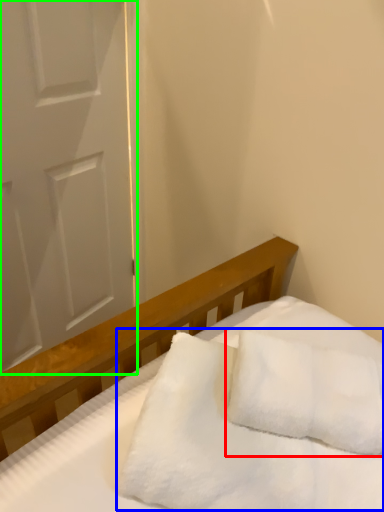
Question: Estimate the real-world distances between objects in this image. Which object is farther from pillow (highlighted by a red box), blanket (highlighted by a blue box) or door (highlighted by a green box)?

Choices:
 (A) blanket
 (B) door

Answer: (B)